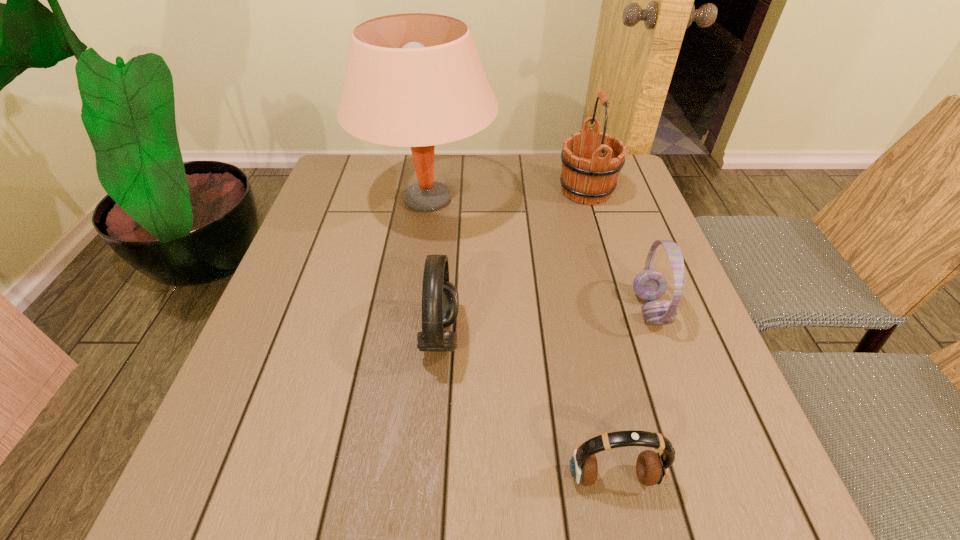
You are a GUI agent. You are given a task and a screenshot of the screen. Output one action in this format:
    pyautogui.click(x=<x>, y=<y>)
    Task: Click on the empty space that is in between the leftmost headset and the rightmost headset
    The height and width of the screenshot is (540, 960).
    Given the screenshot: What is the action you would take?
    coord(545,322)

Identify the location of vacant space in between the rightmost headset and the shortest headset. This screenshot has height=540, width=960. 632,393.

Where is `free space between the shortest headset and the leftmost headset`? The height and width of the screenshot is (540, 960). free space between the shortest headset and the leftmost headset is located at coordinates (527, 406).

Where is `vacant space that is in between the second tallest object and the lampshade`? vacant space that is in between the second tallest object and the lampshade is located at coordinates (507, 195).

I want to click on empty location between the fourth shortest object and the tallest object, so click(507, 195).

You are a GUI agent. You are given a task and a screenshot of the screen. Output one action in this format:
    pyautogui.click(x=<x>, y=<y>)
    Task: Click on the object that is the second closest one to the lampshade
    This screenshot has height=540, width=960.
    Given the screenshot: What is the action you would take?
    pyautogui.click(x=440, y=301)

What are the coordinates of `object that stands as the closest to the rightmost headset` in the screenshot? It's located at (652, 468).

Choose which headset is the second nearest neighbor to the leftmost headset. Please provide its 2D coordinates. Your answer should be formatted as a tuple, i.e. [(x, y)], where the tuple contains the x and y coordinates of a point satisfying the conditions above.

[(649, 285)]

Image resolution: width=960 pixels, height=540 pixels. In order to click on headset object that ranks as the second closest to the tallest object in this screenshot , I will do `click(649, 285)`.

Where is `free space that satisfies the following two spatial constraints: 1. on the headband and ear cups of the rightmost headset; 2. on the ear cup of the second headset from left to right`? This screenshot has height=540, width=960. free space that satisfies the following two spatial constraints: 1. on the headband and ear cups of the rightmost headset; 2. on the ear cup of the second headset from left to right is located at coordinates (710, 477).